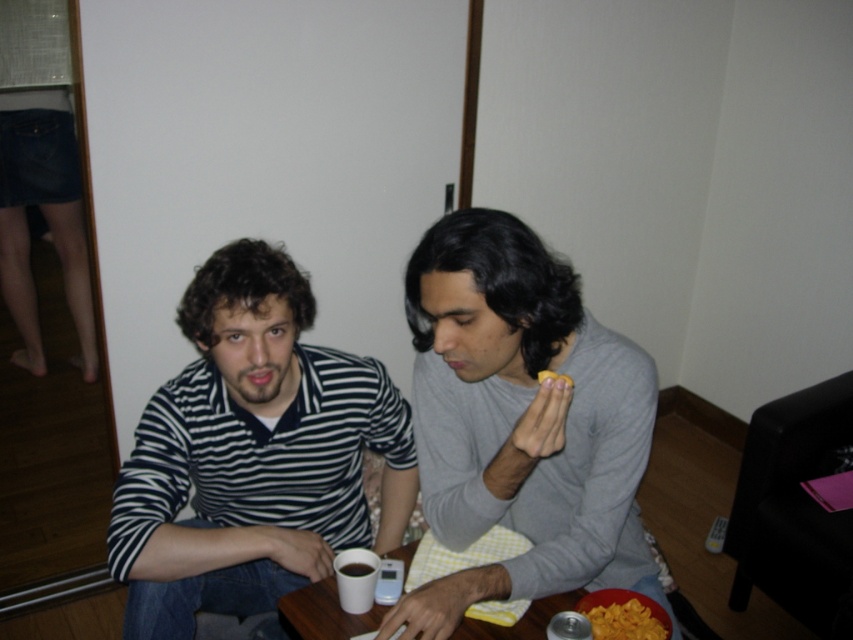
Question: Which point is closer to the camera?

Choices:
 (A) black matte cup at lower center
 (B) yellow crispy chips at lower center

Answer: (B)

Question: Can you confirm if gray matte shirt at center is wider than yellow matte chip at center?

Choices:
 (A) no
 (B) yes

Answer: (B)

Question: Does white matte cup at center have a smaller size compared to black matte cup at lower center?

Choices:
 (A) yes
 (B) no

Answer: (B)

Question: Which object appears farthest from the camera in this image?

Choices:
 (A) yellow crispy chips at lower center
 (B) yellow matte chip at center
 (C) white glossy table at center
 (D) gray matte shirt at center

Answer: (C)

Question: Considering the real-world distances, which object is closest to the black matte cup at lower center?

Choices:
 (A) gray matte shirt at center
 (B) yellow crispy chips at lower center

Answer: (A)

Question: In this image, where is white glossy table at center located relative to black matte cup at lower center?

Choices:
 (A) below
 (B) above

Answer: (A)